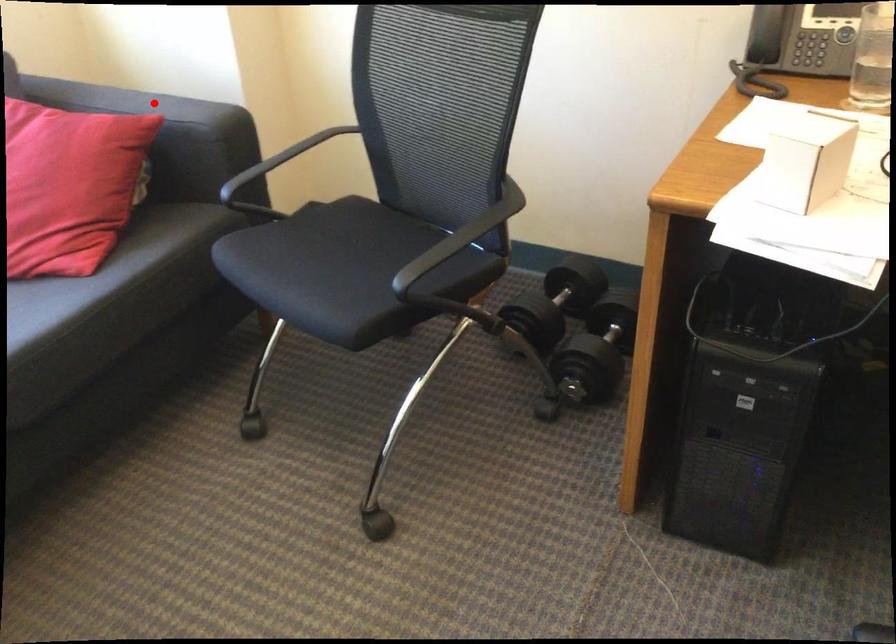
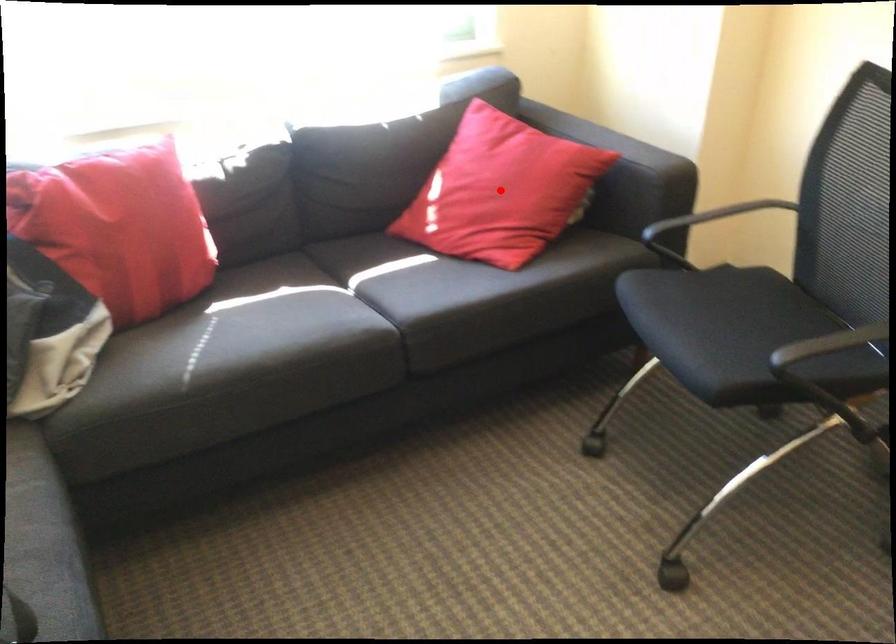
I am providing you with two images of the same scene from different viewpoints. A red point is marked on the first image and another point is marked on the second image. Do the highlighted points in image1 and image2 indicate the same real-world spot?

No